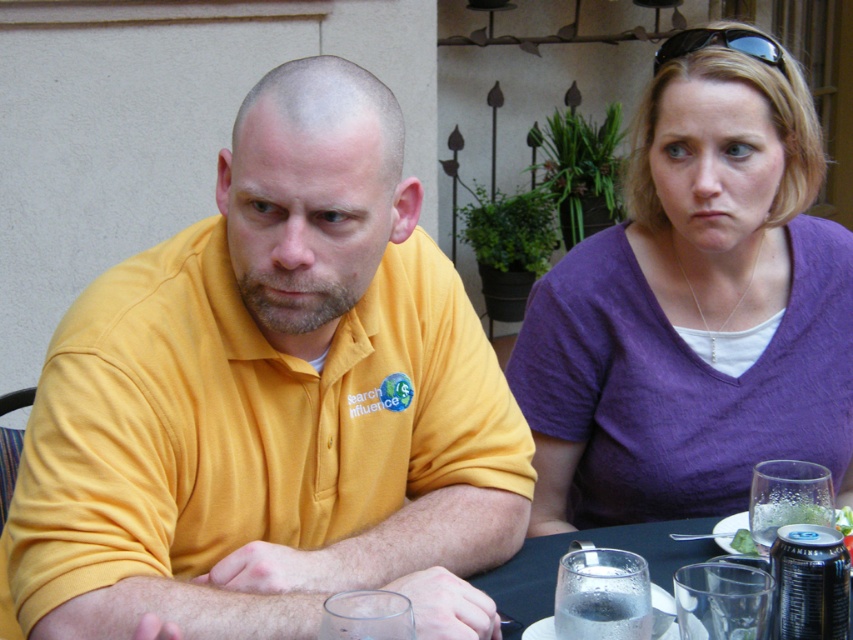
From the picture: You are a photographer trying to capture a closeup of the metallic silver can at lower right without including the purple cotton shirt at upper right in the frame. Given their relative sizes, is this possible?

The purple cotton shirt at upper right is much taller than the metallic silver can at lower right. Since the purple cotton shirt at upper right is taller, it might block the view of the metallic silver can at lower right depending on their positions, making it challenging to frame the can without including the shirt.

You are a photographer taking a picture of two people sitting at a table. You want to ensure both the yellow cotton shirt at left and the purple cotton shirt at upper right are clearly visible in the frame. Which shirt should you position closer to the center of the image to achieve this?

The purple cotton shirt at upper right should be positioned closer to the center of the image because it is already on the upper right, so moving it towards the center would help both shirts be more visible.